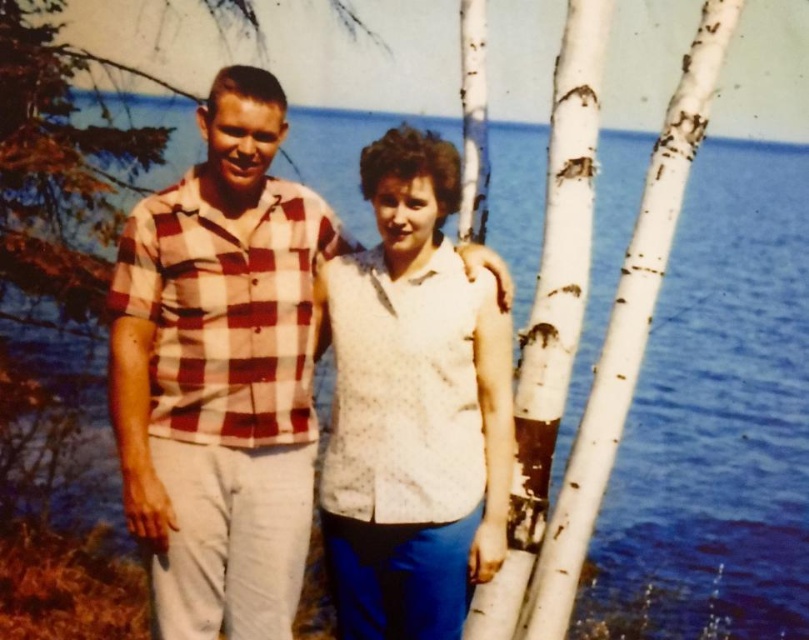
Question: Which point is farther to the camera?

Choices:
 (A) (210, 220)
 (B) (422, 353)

Answer: (A)

Question: Does checkered fabric shirt at center have a greater width compared to white dotted shirt at center?

Choices:
 (A) no
 (B) yes

Answer: (B)

Question: Does checkered fabric shirt at center lie behind white dotted shirt at center?

Choices:
 (A) yes
 (B) no

Answer: (A)

Question: Which point is farther to the camera?

Choices:
 (A) checkered fabric shirt at center
 (B) white dotted shirt at center

Answer: (A)

Question: Can you confirm if checkered fabric shirt at center is bigger than white dotted shirt at center?

Choices:
 (A) no
 (B) yes

Answer: (B)